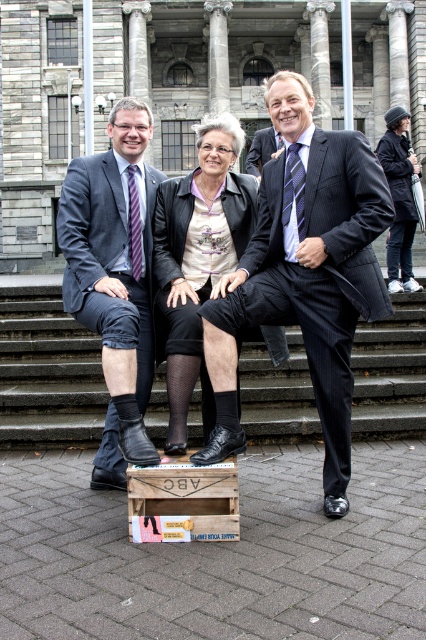
Who is shorter, dark pinstripe suit at center or wooden crate at lower center?

wooden crate at lower center is shorter.

Is point (282, 216) positioned behind point (181, 540)?

Yes, point (282, 216) is farther from viewer.

I want to click on dark pinstripe suit at center, so click(305, 273).

Locate an element on the screen. smooth concrete stairs at center is located at coordinates (48, 371).

Can you confirm if smooth concrete stairs at center is positioned above matte black suit at center?

No, smooth concrete stairs at center is not above matte black suit at center.

What do you see at coordinates (48, 371) in the screenshot? Image resolution: width=426 pixels, height=640 pixels. I see `smooth concrete stairs at center` at bounding box center [48, 371].

Locate an element on the screen. This screenshot has width=426, height=640. smooth concrete stairs at center is located at coordinates (48, 371).

Can you confirm if matte black suit at center is positioned above wooden crate at lower center?

Yes.

Which of these two, matte black suit at center or wooden crate at lower center, stands shorter?

wooden crate at lower center is shorter.

Who is more distant from viewer, [115,310] or [201,529]?

Point [115,310]

Locate an element on the screen. Image resolution: width=426 pixels, height=640 pixels. matte black suit at center is located at coordinates (115, 278).